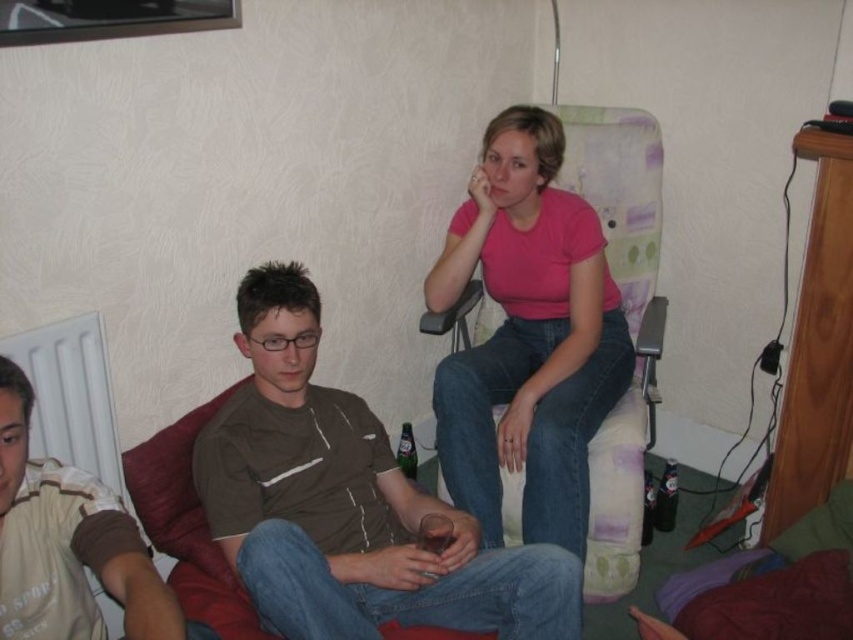
You are a photographer setting up a shoot in the living room. You notice the brown cotton shirt at lower left and the green glass bottle at center. Which object is covering the other?

The brown cotton shirt at lower left is positioned over the green glass bottle at center, so it is covering the bottle.

You are a photographer setting up a tripod in the living room. You need to ensure that the pink matte shirt at center and the green glass bottle at lower right are both visible in the shot. Given their heights, which object will appear larger in the photograph?

The pink matte shirt at center will appear larger in the photograph because it has a greater height compared to the green glass bottle at lower right.

You are a photographer setting up a shoot in the living room. You have a brown cotton shirt at center and a green glass bottle at center in your frame. Which object should you zoom in on to fill the frame more effectively?

The brown cotton shirt at center is bigger than the green glass bottle at center, so zooming in on the brown cotton shirt at center would fill the frame more effectively.